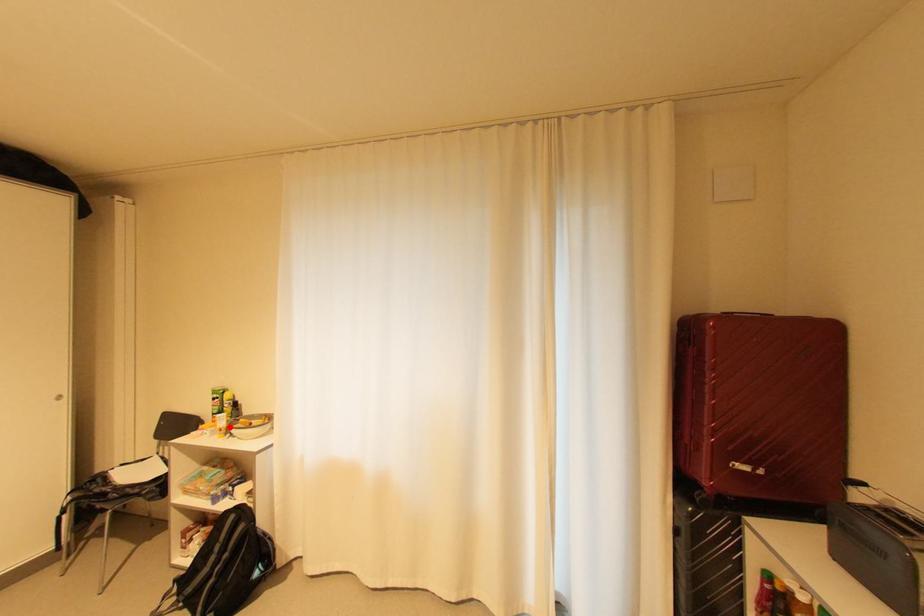
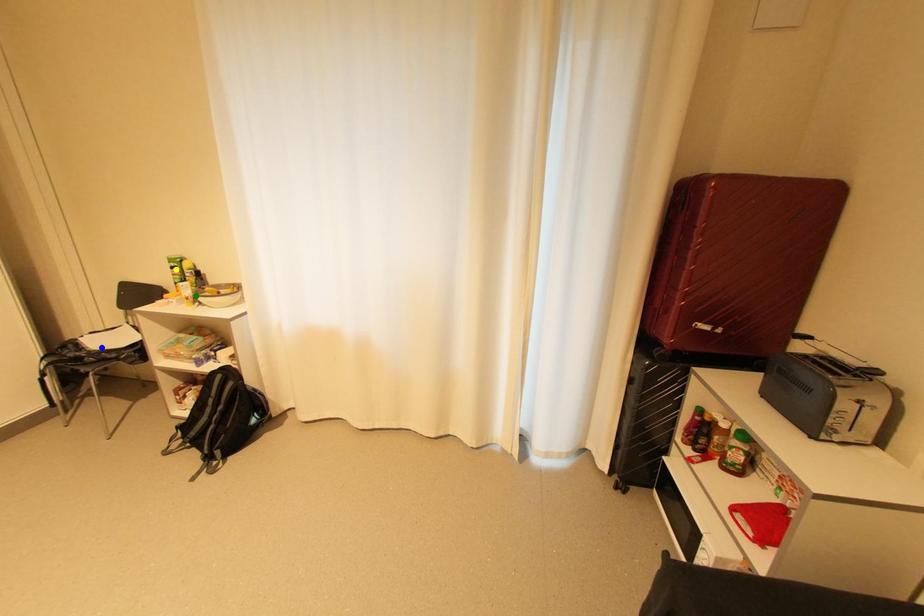
Question: I am providing you with two images of the same scene from different viewpoints. A red point is marked on the first image. You are given multiple points on the second image. Which spot in image 2 lines up with the point in image 1?

Choices:
 (A) yellow point
 (B) green point
 (C) blue point

Answer: (B)